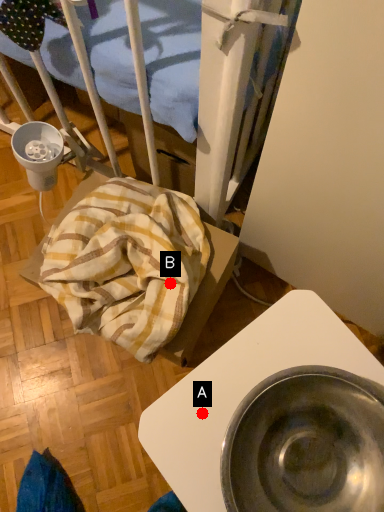
Question: Two points are circled on the image, labeled by A and B beside each circle. Which point is further to the camera?

Choices:
 (A) A is further
 (B) B is further

Answer: (B)